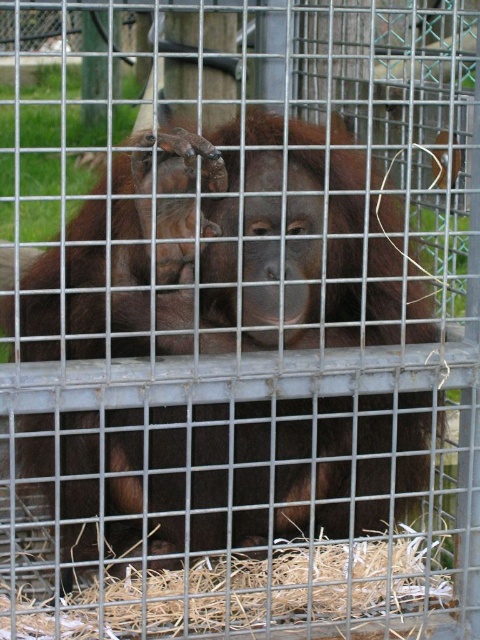
Question: Among these objects, which one is farthest from the camera?

Choices:
 (A) brown furry orangutan at center
 (B) straw at lower center

Answer: (B)

Question: Does brown furry orangutan at center lie in front of straw at lower center?

Choices:
 (A) no
 (B) yes

Answer: (B)

Question: Among these objects, which one is farthest from the camera?

Choices:
 (A) straw at lower center
 (B) brown furry orangutan at center

Answer: (A)

Question: Which point is closer to the camera?

Choices:
 (A) (428, 605)
 (B) (392, 400)

Answer: (A)

Question: Does brown furry orangutan at center lie in front of straw at lower center?

Choices:
 (A) no
 (B) yes

Answer: (B)

Question: Can you confirm if brown furry orangutan at center is bigger than straw at lower center?

Choices:
 (A) yes
 (B) no

Answer: (A)